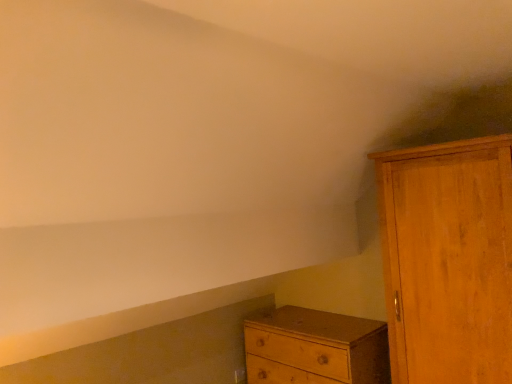
What is the approximate height of wooden cupboard at right?

The height of wooden cupboard at right is 4.67 feet.

You are a GUI agent. You are given a task and a screenshot of the screen. Output one action in this format:
    pyautogui.click(x=<x>, y=<y>)
    Task: Click on the wooden cupboard at right
    
    Given the screenshot: What is the action you would take?
    pyautogui.click(x=448, y=260)

The width and height of the screenshot is (512, 384). What do you see at coordinates (448, 260) in the screenshot?
I see `wooden cupboard at right` at bounding box center [448, 260].

What is the approximate width of wooden chest of drawers at lower center?

wooden chest of drawers at lower center is 20.40 inches wide.

This screenshot has width=512, height=384. Describe the element at coordinates (315, 348) in the screenshot. I see `wooden chest of drawers at lower center` at that location.

At what (x,y) coordinates should I click in order to perform the action: click on wooden chest of drawers at lower center. Please return your answer as a coordinate pair (x, y). Looking at the image, I should click on (315, 348).

Measure the distance between point [276,378] and camera.

The depth of point [276,378] is 2.74 meters.

At what (x,y) coordinates should I click in order to perform the action: click on wooden cupboard at right. Please return your answer as a coordinate pair (x, y). Image resolution: width=512 pixels, height=384 pixels. Looking at the image, I should click on (448, 260).

Which object is positioned more to the right, wooden cupboard at right or wooden chest of drawers at lower center?

From the viewer's perspective, wooden cupboard at right appears more on the right side.

Which object is further away from the camera, wooden cupboard at right or wooden chest of drawers at lower center?

wooden chest of drawers at lower center is further from the camera.

Which is in front, point (446, 250) or point (359, 361)?

Point (446, 250)

From the image's perspective, which object appears higher, wooden cupboard at right or wooden chest of drawers at lower center?

wooden cupboard at right is shown above in the image.

From a real-world perspective, is wooden cupboard at right beneath wooden chest of drawers at lower center?

Actually, wooden cupboard at right is physically above wooden chest of drawers at lower center in the real world.

Between wooden cupboard at right and wooden chest of drawers at lower center, which one has larger width?

wooden cupboard at right is wider.

Between wooden cupboard at right and wooden chest of drawers at lower center, which one has more height?

Standing taller between the two is wooden cupboard at right.

Who is smaller, wooden cupboard at right or wooden chest of drawers at lower center?

wooden chest of drawers at lower center is smaller.

Is wooden chest of drawers at lower center surrounded by wooden cupboard at right?

No, wooden chest of drawers at lower center is not inside wooden cupboard at right.

Is wooden cupboard at right not near wooden chest of drawers at lower center?

wooden cupboard at right is actually quite close to wooden chest of drawers at lower center.

Is wooden cupboard at right aimed at wooden chest of drawers at lower center?

No.

How many degrees apart are the facing directions of wooden cupboard at right and wooden chest of drawers at lower center?

There is a 0.262-degree angle between the facing directions of wooden cupboard at right and wooden chest of drawers at lower center.

Locate an element on the screen. the chest of drawers located underneath the wooden cupboard at right (from a real-world perspective) is located at coordinates [x=315, y=348].

Based on the photo, between wooden chest of drawers at lower center and wooden cupboard at right, which one appears on the right side from the viewer's perspective?

wooden cupboard at right is more to the right.

Looking at this image, considering their positions, is wooden chest of drawers at lower center located in front of or behind wooden cupboard at right?

In the image, wooden chest of drawers at lower center appears behind wooden cupboard at right.

Considering the points (245, 336) and (506, 327), which point is in front, point (245, 336) or point (506, 327)?

Point (506, 327)

From the image's perspective, between wooden chest of drawers at lower center and wooden cupboard at right, which one is located above?

wooden cupboard at right appears higher in the image.

Consider the image. From a real-world perspective, is wooden chest of drawers at lower center located beneath wooden cupboard at right?

Yes, from a real-world perspective, wooden chest of drawers at lower center is under wooden cupboard at right.

Is wooden chest of drawers at lower center thinner than wooden cupboard at right?

Yes, wooden chest of drawers at lower center is thinner than wooden cupboard at right.

Between wooden chest of drawers at lower center and wooden cupboard at right, which one has more height?

Standing taller between the two is wooden cupboard at right.

Between wooden chest of drawers at lower center and wooden cupboard at right, which one has larger size?

Bigger between the two is wooden cupboard at right.

Is wooden chest of drawers at lower center completely or partially outside of wooden cupboard at right?

Yes, wooden chest of drawers at lower center is outside of wooden cupboard at right.

Is wooden chest of drawers at lower center placed right next to wooden cupboard at right?

No.

Is wooden chest of drawers at lower center turned away from wooden cupboard at right?

wooden chest of drawers at lower center is not turned away from wooden cupboard at right.

Identify the location of cupboard above the wooden chest of drawers at lower center (from a real-world perspective). (448, 260).

You are a GUI agent. You are given a task and a screenshot of the screen. Output one action in this format:
    pyautogui.click(x=<x>, y=<y>)
    Task: Click on the cupboard in front of the wooden chest of drawers at lower center
    
    Given the screenshot: What is the action you would take?
    pyautogui.click(x=448, y=260)

Image resolution: width=512 pixels, height=384 pixels. I want to click on chest of drawers on the left of wooden cupboard at right, so click(x=315, y=348).